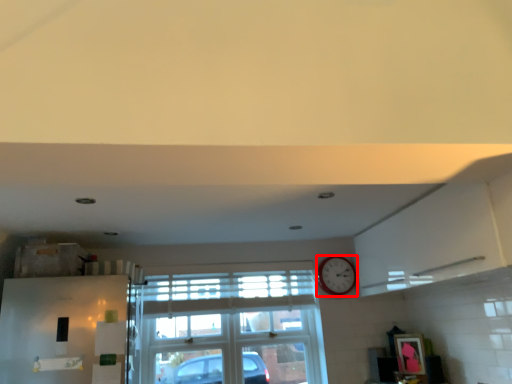
Question: From the image, what is the correct spatial relationship of clock (annotated by the red box) in relation to window?

Choices:
 (A) left
 (B) right

Answer: (B)